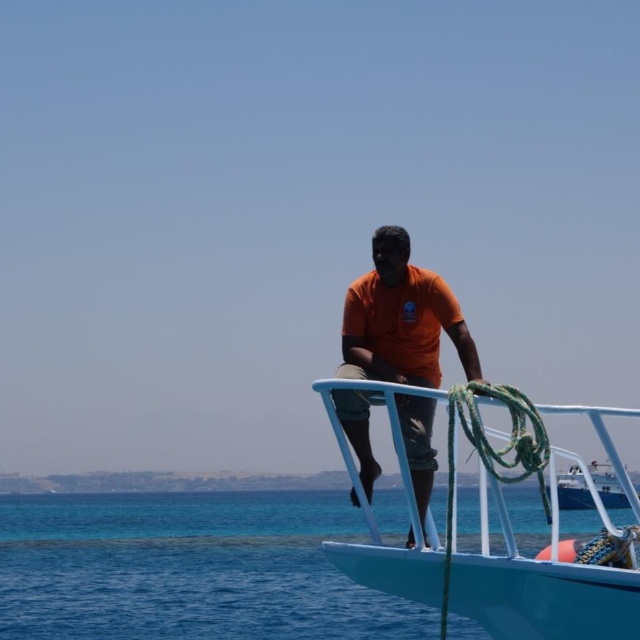
Question: Which point is farther from the camera taking this photo?

Choices:
 (A) (148, 516)
 (B) (417, 362)

Answer: (A)

Question: Does white glossy boat at center appear under white glossy boat at right?

Choices:
 (A) yes
 (B) no

Answer: (B)

Question: Is blue water at lower left smaller than white glossy boat at right?

Choices:
 (A) no
 (B) yes

Answer: (A)

Question: Which object is positioned farthest from the white glossy boat at center?

Choices:
 (A) white glossy boat at right
 (B) blue water at lower left

Answer: (B)

Question: Among these objects, which one is farthest from the camera?

Choices:
 (A) white glossy boat at right
 (B) blue water at lower left

Answer: (A)

Question: Is blue water at lower left smaller than white glossy boat at center?

Choices:
 (A) no
 (B) yes

Answer: (A)